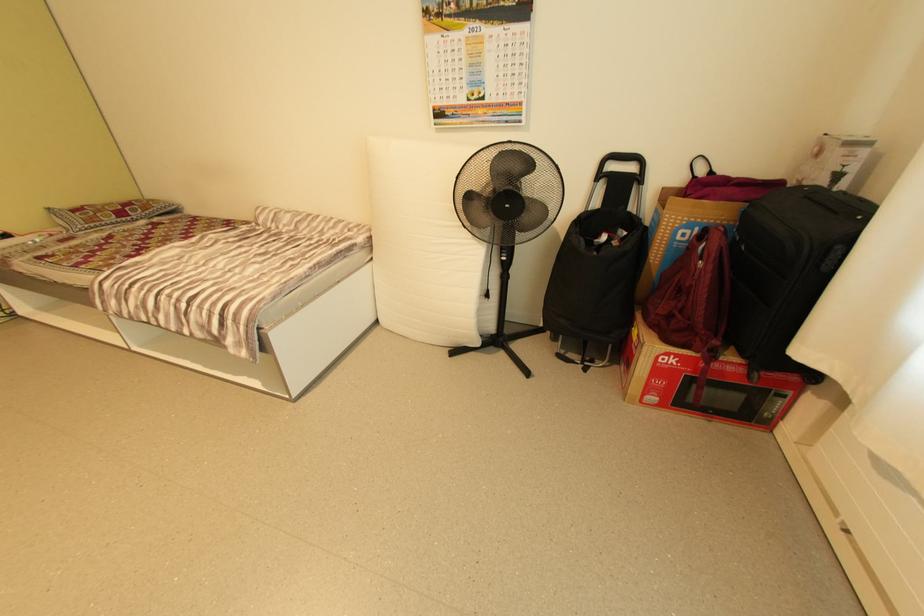
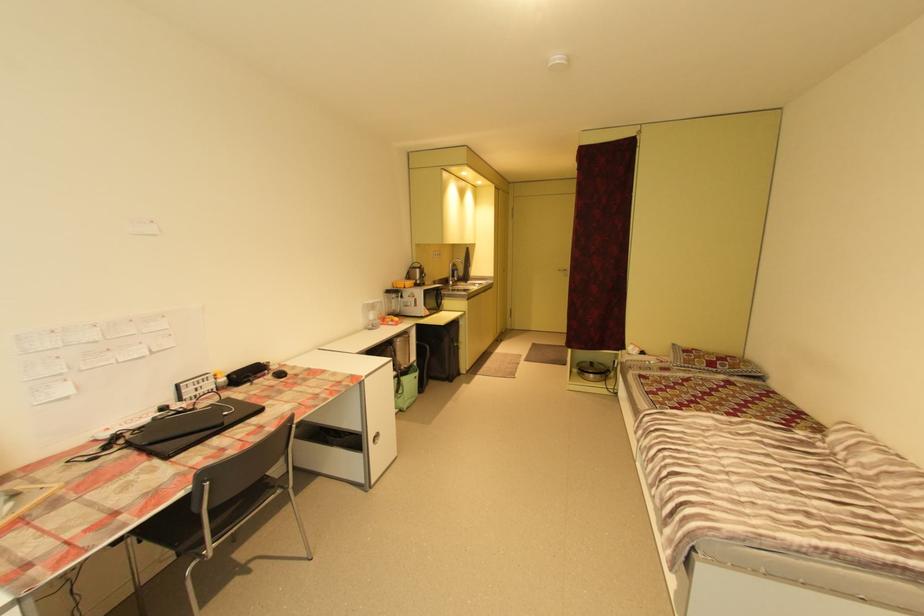
Question: The first image is from the beginning of the video and the second image is from the end. How did the camera likely rotate when shooting the video?

Choices:
 (A) Left
 (B) Right
 (C) Up
 (D) Down

Answer: (A)